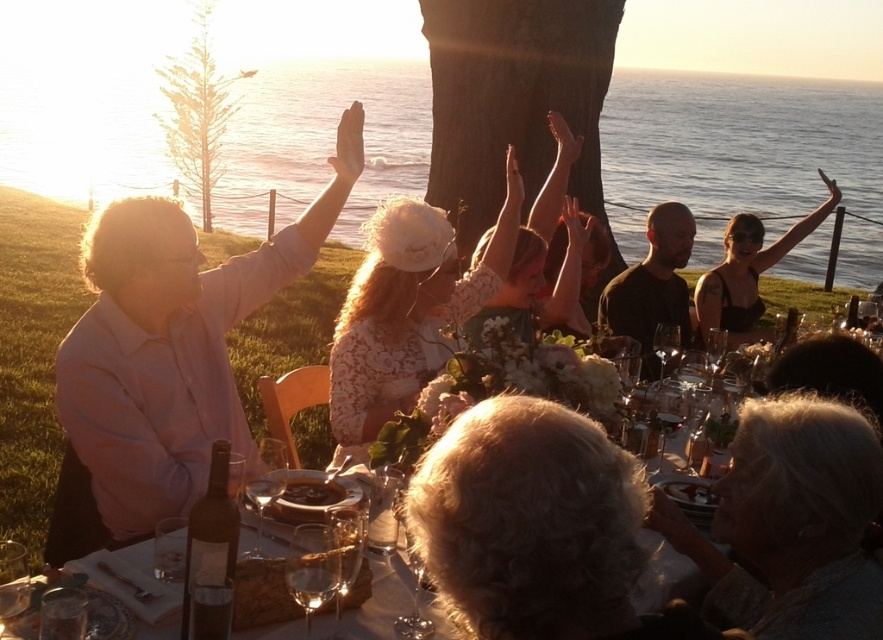
You are standing at the edge of the grassy area overlooking the ocean and see two points in the scene. Which point is closer to you, point (443,280) or point (798,220)?

Point (443,280) is closer to the viewer than point (798,220).

You are at a sunset gathering and want to find the matte pink shirt at left. Which direction should you look relative to the dark brown wooden plate at center?

The matte pink shirt at left is to the left of the dark brown wooden plate at center, so look to the left side of the dark brown wooden plate at center to find it.